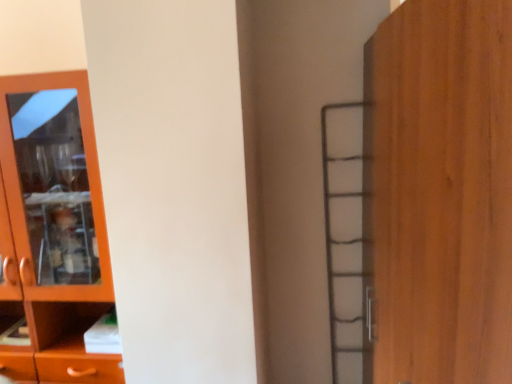
Question: Is point (57, 316) positioned closer to the camera than point (402, 332)?

Choices:
 (A) closer
 (B) farther

Answer: (B)

Question: From a real-world perspective, is matte wood cupboard at left positioned above or below wooden door at right?

Choices:
 (A) above
 (B) below

Answer: (B)

Question: From the image's perspective, is matte wood cupboard at left above or below wooden door at right?

Choices:
 (A) below
 (B) above

Answer: (B)

Question: From the image's perspective, is wooden door at right above or below matte wood cupboard at left?

Choices:
 (A) below
 (B) above

Answer: (A)

Question: Considering the positions of wooden door at right and matte wood cupboard at left in the image, is wooden door at right taller or shorter than matte wood cupboard at left?

Choices:
 (A) short
 (B) tall

Answer: (A)

Question: Is wooden door at right in front of or behind matte wood cupboard at left in the image?

Choices:
 (A) behind
 (B) front

Answer: (B)

Question: Considering the relative positions of wooden door at right and matte wood cupboard at left in the image provided, is wooden door at right to the left or to the right of matte wood cupboard at left?

Choices:
 (A) right
 (B) left

Answer: (A)